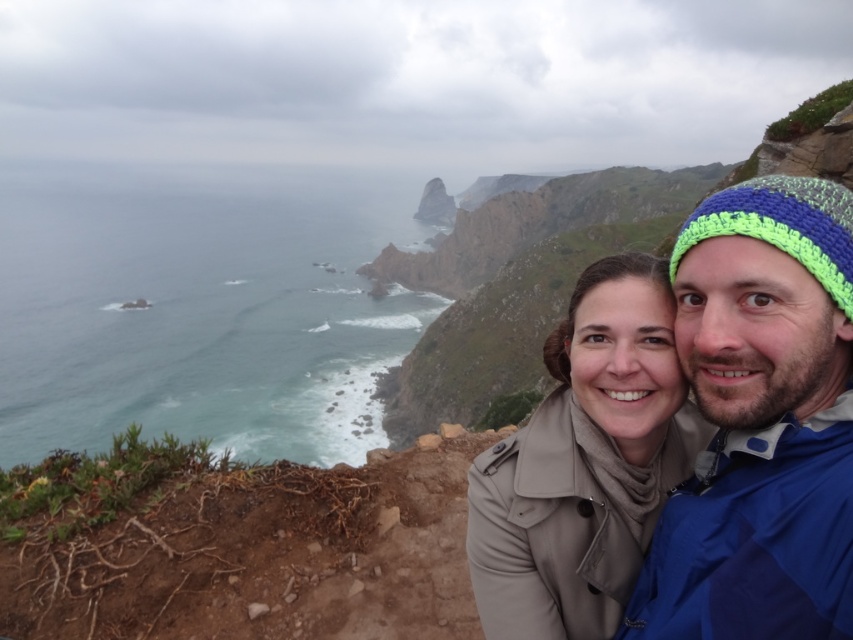
Can you confirm if blue knitted beanie at right is taller than beige fabric coat at center?

In fact, blue knitted beanie at right may be shorter than beige fabric coat at center.

Which is behind, point (743, 480) or point (467, 550)?

The point (467, 550) is behind.

Find the location of a particular element. This screenshot has height=640, width=853. blue knitted beanie at right is located at coordinates (759, 422).